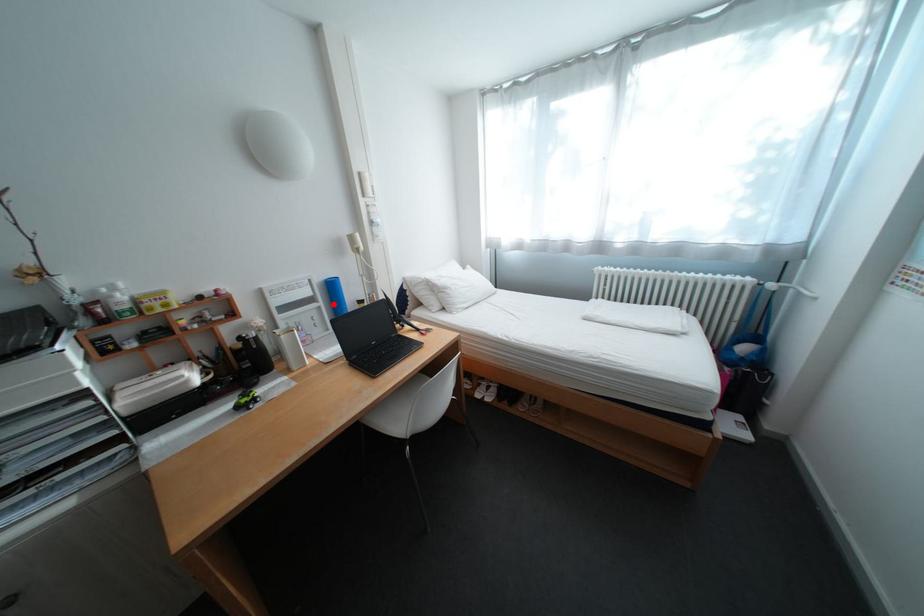
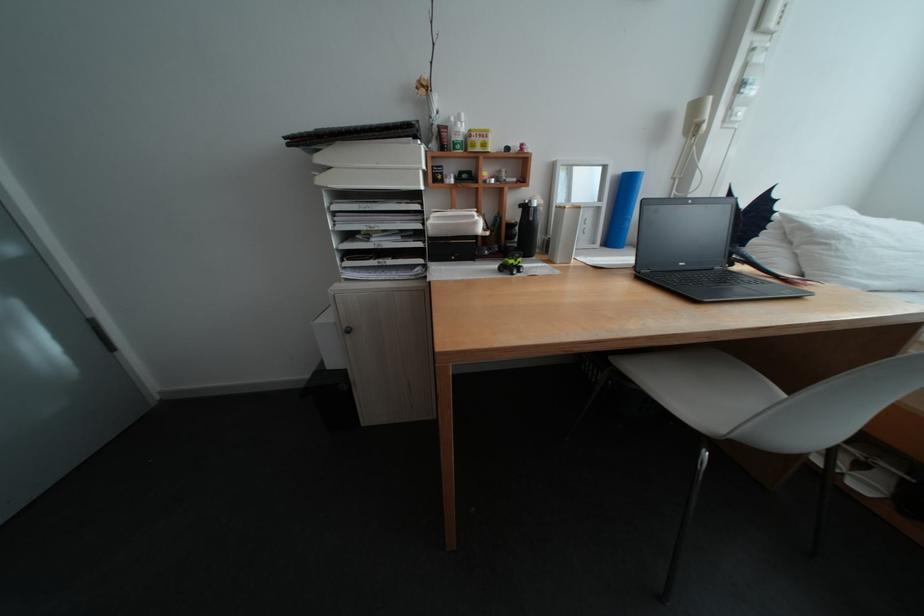
Where in the second image is the point corresponding to the highlighted location from the first image?

(616, 205)